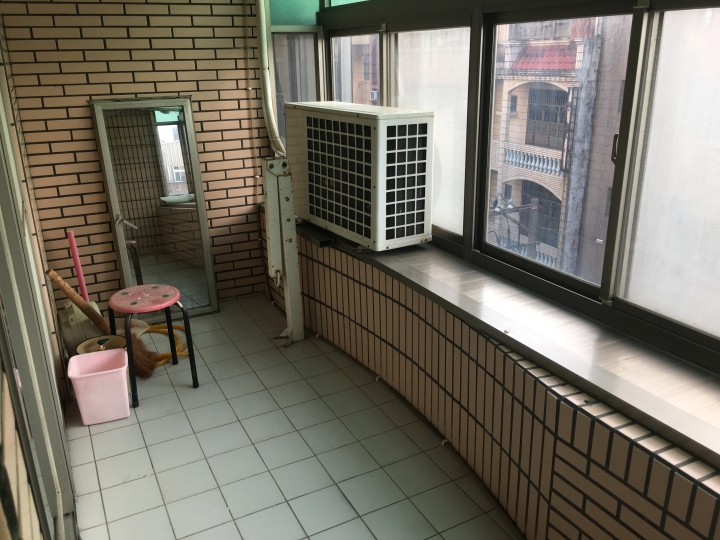
Locate an element on the screen. mirror is located at coordinates (153, 209).